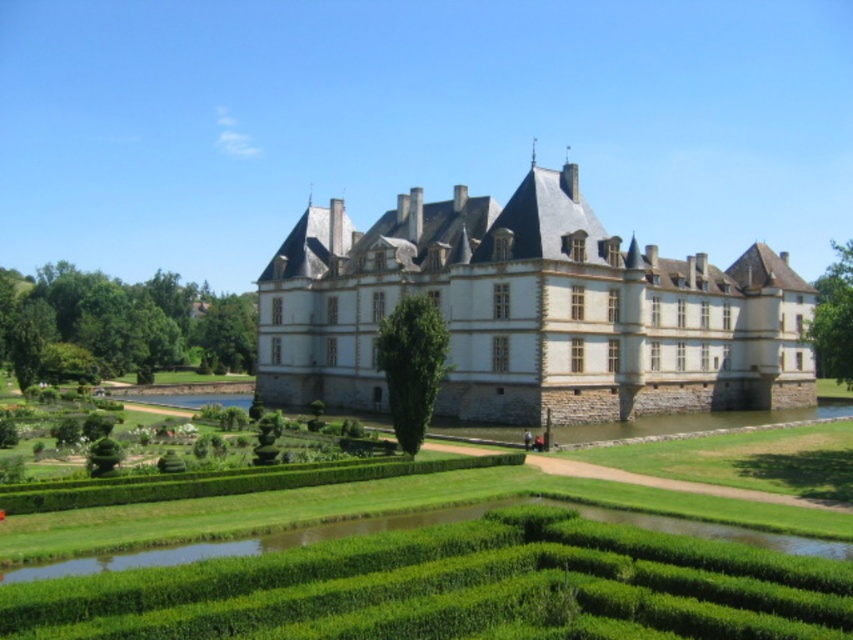
Which is more to the left, stone gray castle at center or green hedge at center?

From the viewer's perspective, green hedge at center appears more on the left side.

Does stone gray castle at center have a greater width compared to green hedge at center?

Yes.

Is point (521, 232) farther from camera compared to point (643, 602)?

Yes, point (521, 232) is farther from viewer.

This screenshot has width=853, height=640. Identify the location of stone gray castle at center. (531, 312).

Is green hedge at center in front of green leafy hedge at lower left?

Yes.

Which of these two, green hedge at center or green leafy hedge at lower left, stands shorter?

With less height is green hedge at center.

Is point (368, 632) in front of point (155, 355)?

Yes, point (368, 632) is in front of point (155, 355).

Locate an element on the screen. green hedge at center is located at coordinates (454, 589).

Who is lower down, stone gray castle at center or green leafy hedge at lower left?

Positioned lower is stone gray castle at center.

Image resolution: width=853 pixels, height=640 pixels. Identify the location of stone gray castle at center. (531, 312).

Locate an element on the screen. The width and height of the screenshot is (853, 640). stone gray castle at center is located at coordinates (531, 312).